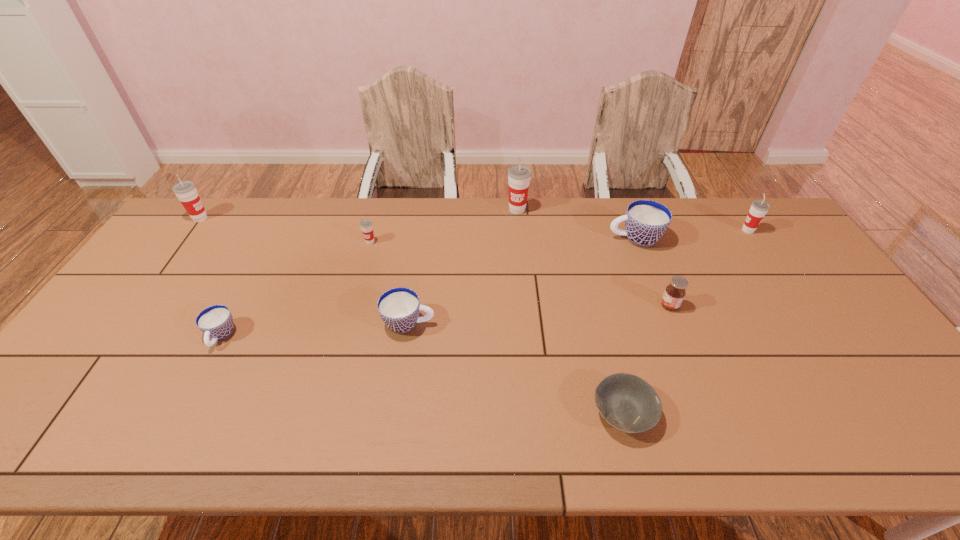
Identify the location of vacant point located on the side of the leftmost blue cup with the handle. (200, 376).

The image size is (960, 540). What are the coordinates of `vacant space situated 0.170m on the back of the nearest object` in the screenshot? It's located at (602, 330).

Image resolution: width=960 pixels, height=540 pixels. I want to click on object located in the near edge section of the desktop, so click(628, 403).

Where is `object at the left edge`? The height and width of the screenshot is (540, 960). object at the left edge is located at coordinates (186, 191).

Locate an element on the screen. This screenshot has width=960, height=540. object at the right edge is located at coordinates (759, 208).

Find the location of `object present at the far left corner`. object present at the far left corner is located at coordinates (186, 191).

The width and height of the screenshot is (960, 540). Identify the location of object located at the far right corner. click(x=759, y=208).

This screenshot has height=540, width=960. What are the coordinates of `free space at the far edge of the desktop` in the screenshot? It's located at (324, 218).

This screenshot has width=960, height=540. In order to click on free space at the near edge in this screenshot , I will do `click(205, 433)`.

At what (x,y) coordinates should I click in order to perform the action: click on vacant region at the left edge of the desktop. Please return your answer as a coordinate pair (x, y). The width and height of the screenshot is (960, 540). Looking at the image, I should click on (137, 318).